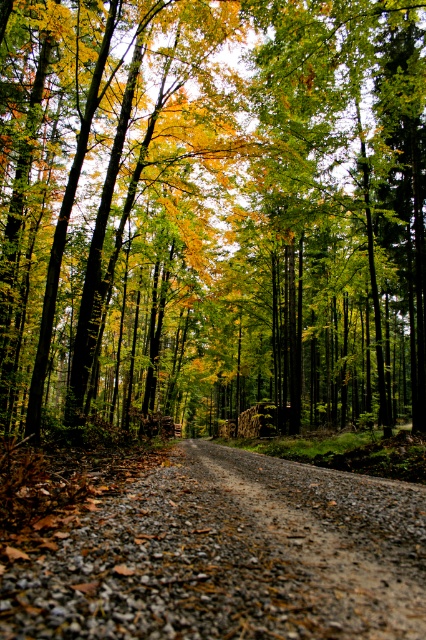
How much distance is there between golden leafy trees at center and gray gravel road at center?

A distance of 28.91 meters exists between golden leafy trees at center and gray gravel road at center.

What do you see at coordinates (213, 211) in the screenshot? This screenshot has height=640, width=426. I see `golden leafy trees at center` at bounding box center [213, 211].

Between point (92, 193) and point (100, 518), which one is positioned behind?

Point (92, 193)

Find the location of `golden leafy trees at center`. golden leafy trees at center is located at coordinates (213, 211).